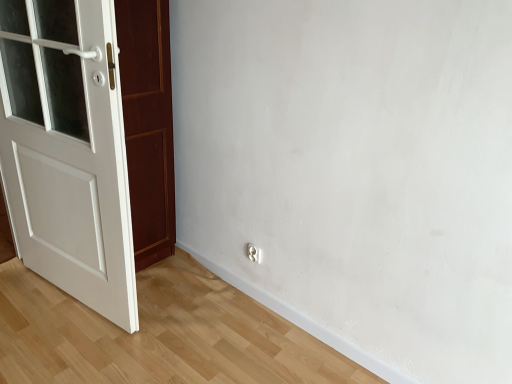
This screenshot has height=384, width=512. What are the coordinates of `free spot to the right of white painted wood door at left` in the screenshot? It's located at (183, 314).